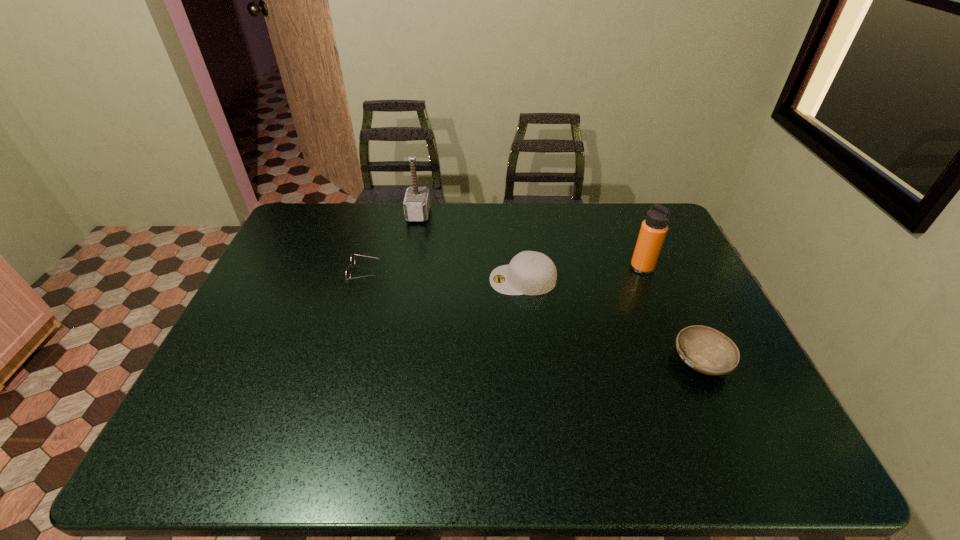
Where is `free region located 0.340m on the left of the thermos bottle`? free region located 0.340m on the left of the thermos bottle is located at coordinates (521, 268).

The image size is (960, 540). I want to click on vacant space located on the front-facing side of the cap, so click(x=446, y=280).

Find the location of a particular element. free space located on the front-facing side of the cap is located at coordinates (403, 280).

The height and width of the screenshot is (540, 960). I want to click on free spot located on the front-facing side of the cap, so click(x=423, y=280).

Locate an element on the screen. The height and width of the screenshot is (540, 960). vacant space located on the left of the second shortest object is located at coordinates (560, 361).

Locate an element on the screen. The height and width of the screenshot is (540, 960). free space located 0.310m on the front-facing side of the shortest object is located at coordinates (479, 273).

This screenshot has width=960, height=540. Find the location of `object that is at the far edge`. object that is at the far edge is located at coordinates (416, 203).

At what (x,y) coordinates should I click in order to perform the action: click on thermos bottle located in the right edge section of the desktop. Please return your answer as a coordinate pair (x, y). The width and height of the screenshot is (960, 540). Looking at the image, I should click on (653, 231).

Where is `bowl located at the right edge`? bowl located at the right edge is located at coordinates (706, 350).

In order to click on vacant space at the far edge of the desktop in this screenshot , I will do `click(460, 202)`.